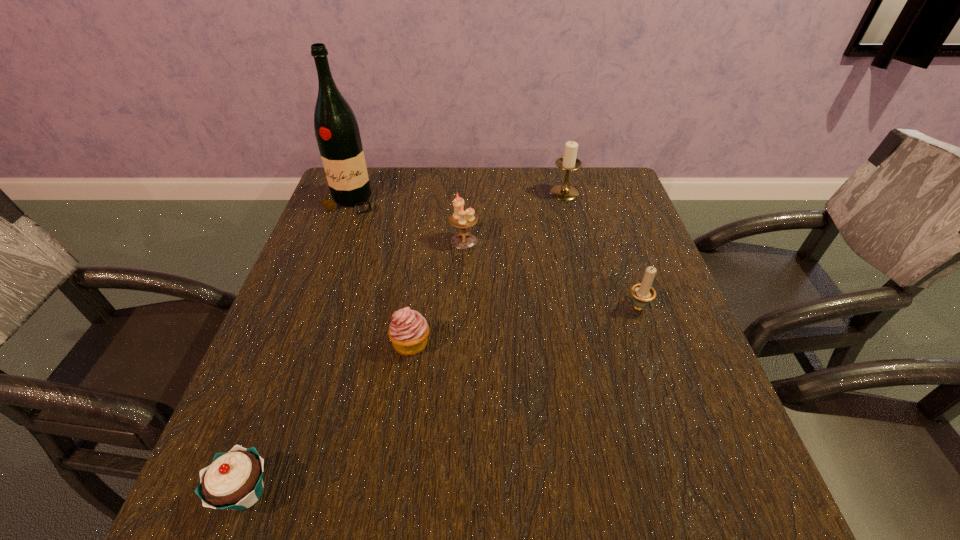
The width and height of the screenshot is (960, 540). I want to click on the left cupcake, so click(x=233, y=481).

This screenshot has height=540, width=960. I want to click on vacant space located 0.260m on the right of the tallest object, so click(467, 202).

What are the coordinates of `vacant region located 0.310m on the left of the fifth object from left to right` in the screenshot? It's located at (444, 193).

At what (x,y) coordinates should I click in order to perform the action: click on free space located on the front of the second shortest candle_holder. Please return your answer as a coordinate pair (x, y). This screenshot has width=960, height=540. Looking at the image, I should click on (461, 319).

Where is `vacant space located 0.380m on the handle side of the rightmost candle_holder`? The image size is (960, 540). vacant space located 0.380m on the handle side of the rightmost candle_holder is located at coordinates (601, 199).

What are the coordinates of `vacant region located on the handle side of the rightmost candle_holder` in the screenshot? It's located at (612, 229).

Find the location of a particular element. This screenshot has height=540, width=960. vacant space located on the handle side of the rightmost candle_holder is located at coordinates pos(613,236).

Where is `vacant point located 0.270m on the right of the right cupcake`? Image resolution: width=960 pixels, height=540 pixels. vacant point located 0.270m on the right of the right cupcake is located at coordinates (563, 343).

Find the location of a particular element. vacant space located on the back of the nearest object is located at coordinates (276, 408).

Image resolution: width=960 pixels, height=540 pixels. What are the coordinates of `wine bottle located in the far edge section of the desktop` in the screenshot? It's located at (337, 133).